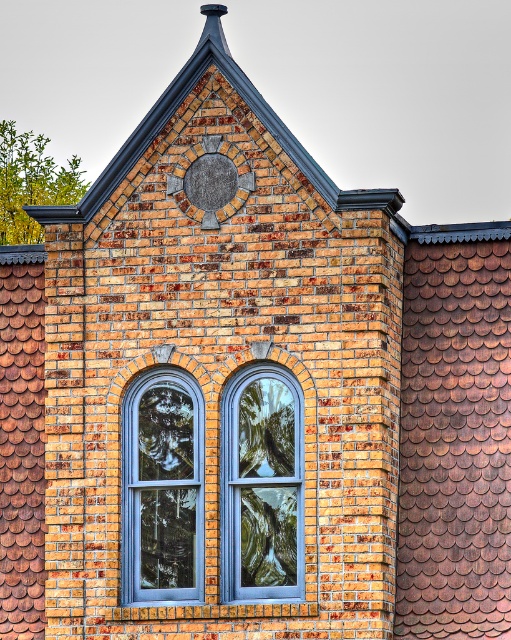
Question: In this image, where is brown shingles at upper center located relative to blue glass window at center?

Choices:
 (A) below
 (B) above

Answer: (B)

Question: Which of these objects is positioned farthest from the brown shingles at upper center?

Choices:
 (A) matte glass window at center
 (B) matte gray clock at center
 (C) brown shingles at upper right
 (D) blue glass window at center

Answer: (A)

Question: Is matte glass window at center thinner than matte gray clock at center?

Choices:
 (A) no
 (B) yes

Answer: (B)

Question: Which point appears farthest from the camera in this image?

Choices:
 (A) (269, 452)
 (B) (147, 24)

Answer: (B)

Question: Which point is farther to the camera?

Choices:
 (A) brown shingles at upper center
 (B) matte glass window at center
 (C) blue glass window at center

Answer: (A)

Question: Is matte glass window at center smaller than matte gray clock at center?

Choices:
 (A) no
 (B) yes

Answer: (B)